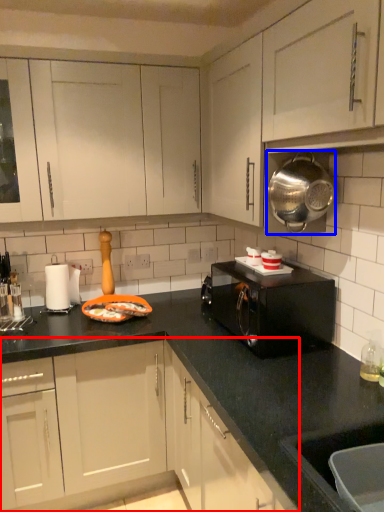
Question: Which point is further to the camera, cabinetry (highlighted by a red box) or appliance (highlighted by a blue box)?

Choices:
 (A) cabinetry
 (B) appliance

Answer: (A)